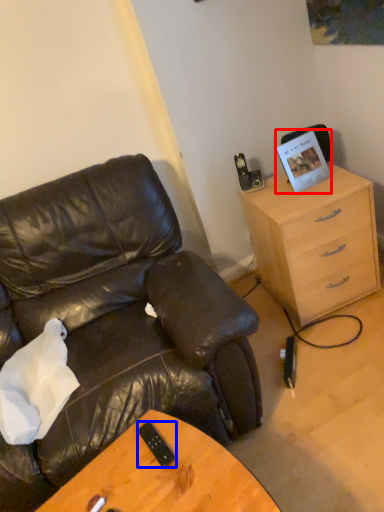
Question: Which of the following is the farthest to the observer, picture frame (highlighted by a red box) or mobile phone (highlighted by a blue box)?

Choices:
 (A) picture frame
 (B) mobile phone

Answer: (A)